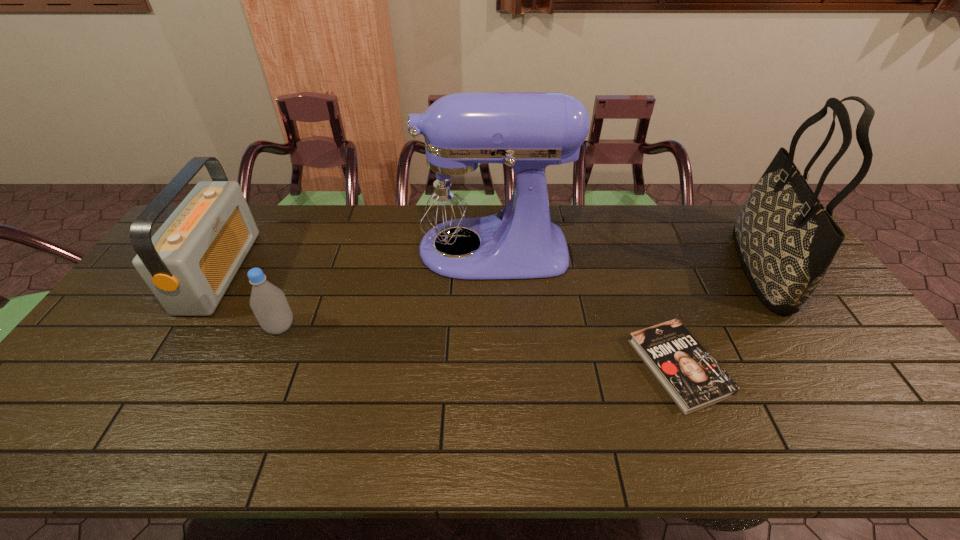
In order to click on object that is at the far left corner in this screenshot , I will do `click(189, 263)`.

Locate an element on the screen. The width and height of the screenshot is (960, 540). object that is at the far right corner is located at coordinates [x=786, y=240].

Find the location of `free spot at the far edge of the desktop`. free spot at the far edge of the desktop is located at coordinates (319, 230).

This screenshot has height=540, width=960. I want to click on vacant space at the near edge of the desktop, so (289, 450).

In the image, there is a desktop. Where is `vacant region at the left edge`? This screenshot has width=960, height=540. vacant region at the left edge is located at coordinates (89, 369).

Where is `free space at the right edge of the desktop`? free space at the right edge of the desktop is located at coordinates (850, 402).

At what (x,y) coordinates should I click in order to perform the action: click on free space at the near left corner of the desktop. Please return your answer as a coordinate pair (x, y). The image size is (960, 540). Looking at the image, I should click on (55, 455).

I want to click on free space between the second shortest object and the book, so click(479, 347).

The height and width of the screenshot is (540, 960). I want to click on vacant region between the bottle and the book, so click(479, 347).

What are the coordinates of `free space between the second object from left to right and the tote bag` in the screenshot? It's located at (521, 297).